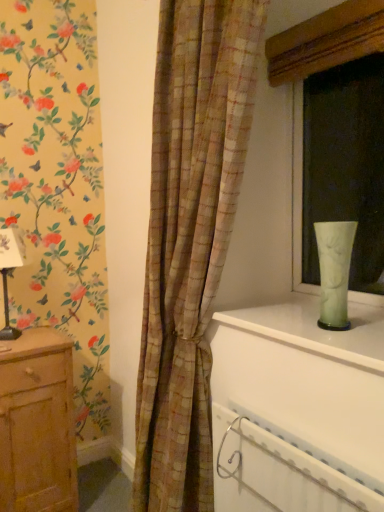
Find the location of a particular element. Image resolution: width=384 pixels, height=512 pixels. vacant area on top of wooden chest of drawers at left (from a real-world perspective) is located at coordinates tap(24, 339).